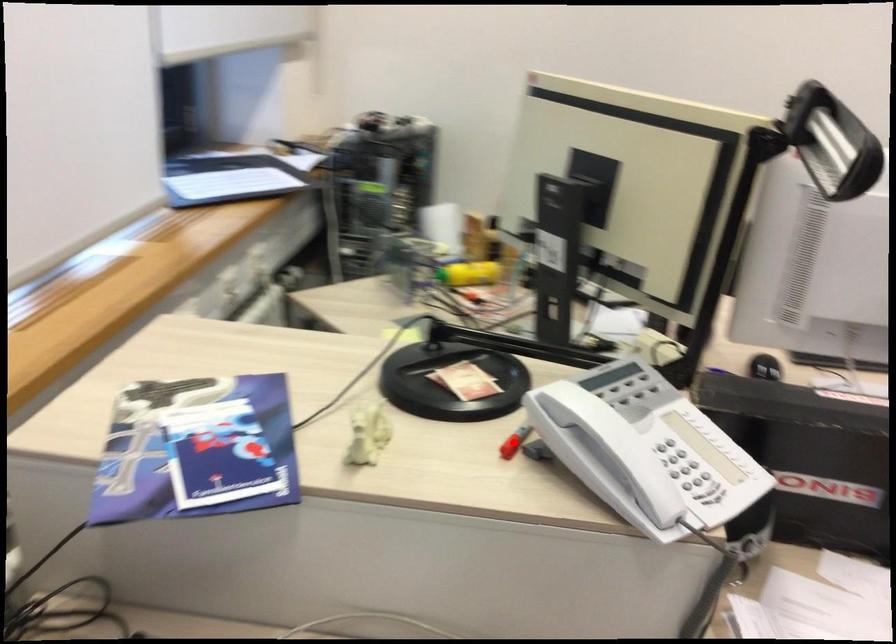
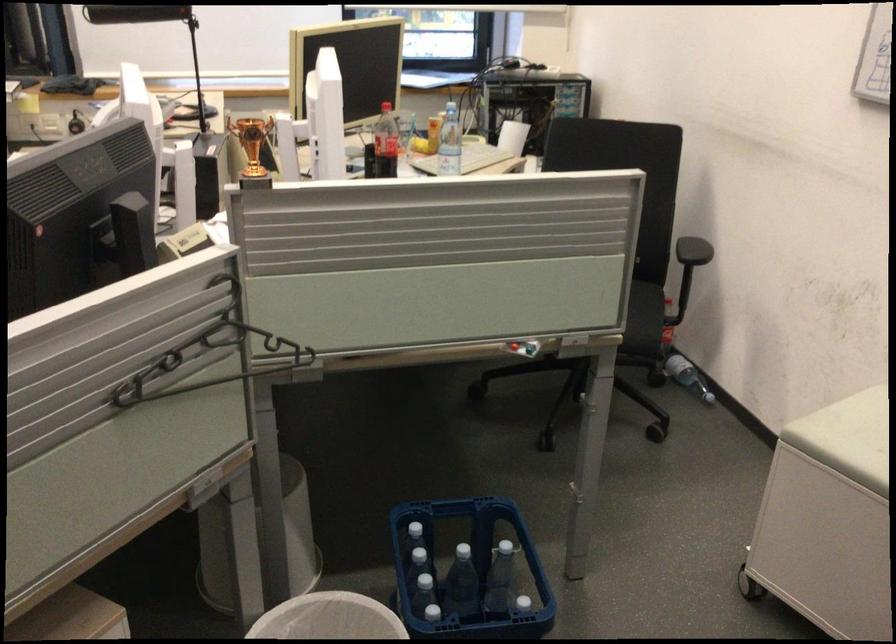
Question: I am providing you with two images of the same scene from different viewpoints. A red point is marked on the first image. At the location where the point appears in image 1, is it still visible in image 2?

Choices:
 (A) Yes
 (B) No

Answer: (B)